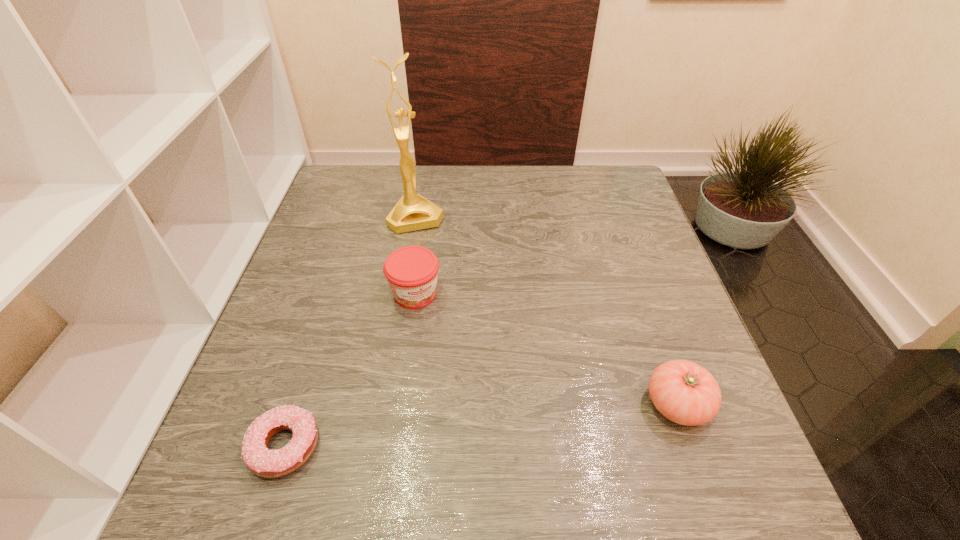
Find the location of a particular element. The height and width of the screenshot is (540, 960). free space between the shortest object and the jam is located at coordinates (350, 370).

The height and width of the screenshot is (540, 960). I want to click on vacant space in between the tomato and the tallest object, so click(x=546, y=310).

Where is `free spot between the jam and the doughnut`? This screenshot has width=960, height=540. free spot between the jam and the doughnut is located at coordinates pyautogui.click(x=350, y=370).

This screenshot has width=960, height=540. I want to click on empty space between the rightmost object and the doughnut, so click(x=481, y=425).

What are the coordinates of `free spot between the farthest object and the leftmost object` in the screenshot? It's located at (350, 332).

Find the location of a particular element. This screenshot has height=540, width=960. the second closest object to the second farthest object is located at coordinates (263, 462).

In order to click on object identified as the second closest to the third nearest object in this screenshot , I will do `click(263, 462)`.